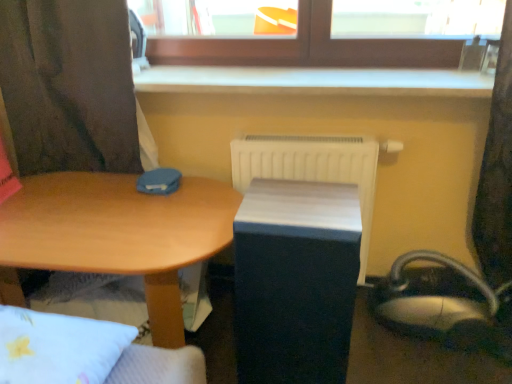
Question: Considering the relative sizes of white plastic radiator at center and matte black changing table at center in the image provided, is white plastic radiator at center shorter than matte black changing table at center?

Choices:
 (A) no
 (B) yes

Answer: (B)

Question: From a real-world perspective, is white plastic radiator at center on top of matte black changing table at center?

Choices:
 (A) no
 (B) yes

Answer: (B)

Question: Is white plastic radiator at center further to the viewer compared to matte black changing table at center?

Choices:
 (A) yes
 (B) no

Answer: (A)

Question: Can you confirm if white plastic radiator at center is taller than matte black changing table at center?

Choices:
 (A) yes
 (B) no

Answer: (B)

Question: Can you confirm if white plastic radiator at center is positioned to the left of matte black changing table at center?

Choices:
 (A) no
 (B) yes

Answer: (A)

Question: Does white plastic radiator at center appear on the right side of matte black changing table at center?

Choices:
 (A) no
 (B) yes

Answer: (B)

Question: Would you say metallic silver swivel chair at lower right is part of matte black changing table at center's contents?

Choices:
 (A) no
 (B) yes

Answer: (A)

Question: Is matte black changing table at center to the right of metallic silver swivel chair at lower right from the viewer's perspective?

Choices:
 (A) no
 (B) yes

Answer: (A)

Question: From a real-world perspective, is matte black changing table at center beneath metallic silver swivel chair at lower right?

Choices:
 (A) no
 (B) yes

Answer: (A)

Question: Is matte black changing table at center not inside metallic silver swivel chair at lower right?

Choices:
 (A) no
 (B) yes

Answer: (B)

Question: Is matte black changing table at center beside metallic silver swivel chair at lower right?

Choices:
 (A) no
 (B) yes

Answer: (A)

Question: Could you tell me if matte black changing table at center is facing metallic silver swivel chair at lower right?

Choices:
 (A) no
 (B) yes

Answer: (A)

Question: Considering the relative positions of matte black changing table at center and wooden desk at center in the image provided, is matte black changing table at center to the right of wooden desk at center from the viewer's perspective?

Choices:
 (A) yes
 (B) no

Answer: (A)